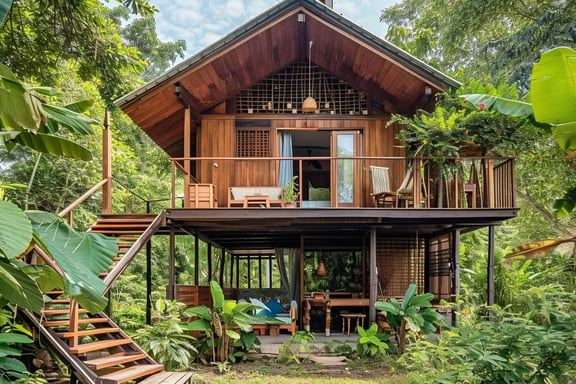
Where is `light`? The width and height of the screenshot is (576, 384). light is located at coordinates click(x=308, y=102).